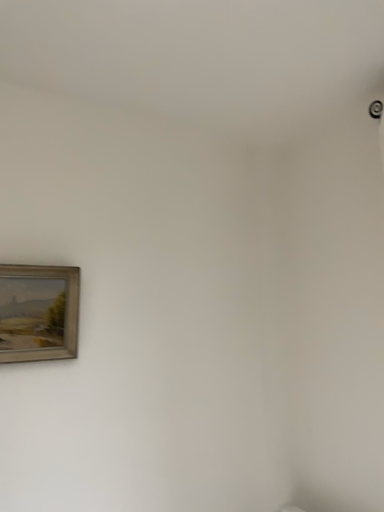
This screenshot has width=384, height=512. Describe the element at coordinates (38, 312) in the screenshot. I see `wooden-framed painting at lower left` at that location.

Measure the distance between point (0, 319) and camera.

1.27 meters.

The height and width of the screenshot is (512, 384). What are the coordinates of `wooden-framed painting at lower left` in the screenshot? It's located at (38, 312).

Find the location of a particular element. The width and height of the screenshot is (384, 512). wooden-framed painting at lower left is located at coordinates (38, 312).